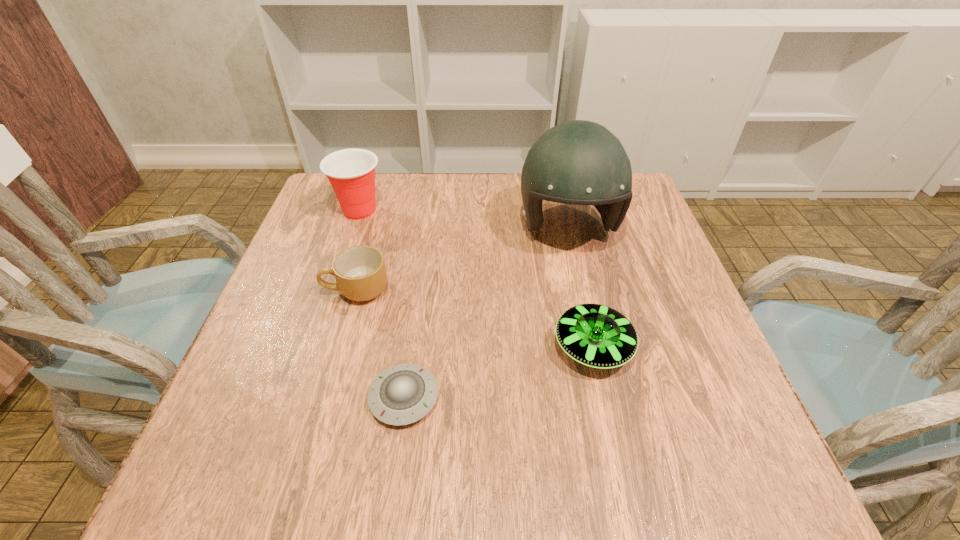
Locate an element on the screen. football helmet is located at coordinates (578, 162).

This screenshot has width=960, height=540. I want to click on the fourth shortest object, so click(351, 172).

At what (x,y) coordinates should I click in order to perform the action: click on the third farthest object. Please return your answer as a coordinate pair (x, y). Looking at the image, I should click on (360, 272).

Locate an element on the screen. the taller saucer is located at coordinates (595, 335).

Where is `the left saucer`? The width and height of the screenshot is (960, 540). the left saucer is located at coordinates (403, 394).

At what (x,y) coordinates should I click in order to perform the action: click on the shorter saucer. Please return your answer as a coordinate pair (x, y). This screenshot has width=960, height=540. Looking at the image, I should click on (403, 394).

Find the location of a particular element. vacant position located at the face opening of the football helmet is located at coordinates (585, 303).

The height and width of the screenshot is (540, 960). Find the location of `vacant area situated 0.300m on the front of the cup`. vacant area situated 0.300m on the front of the cup is located at coordinates (324, 316).

Where is `free point located on the side with the handle of the third nearest object`? The image size is (960, 540). free point located on the side with the handle of the third nearest object is located at coordinates (297, 289).

The height and width of the screenshot is (540, 960). In order to click on free space located 0.150m on the front of the taller saucer in this screenshot , I will do `click(620, 464)`.